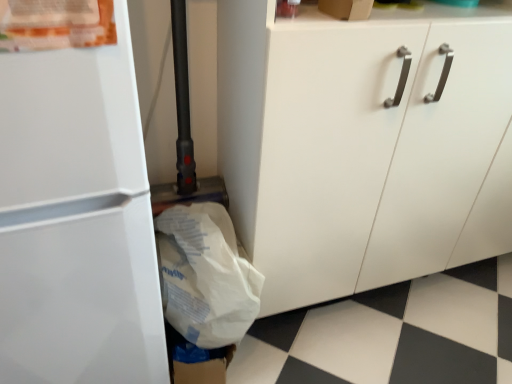
Question: Can you confirm if white glossy refrigerator at left is thinner than white matte cabinet at center?

Choices:
 (A) no
 (B) yes

Answer: (A)

Question: Could you tell me if white glossy refrigerator at left is turned towards white matte cabinet at center?

Choices:
 (A) no
 (B) yes

Answer: (A)

Question: Does white glossy refrigerator at left have a greater width compared to white matte cabinet at center?

Choices:
 (A) yes
 (B) no

Answer: (A)

Question: Is white glossy refrigerator at left positioned in front of white matte cabinet at center?

Choices:
 (A) yes
 (B) no

Answer: (A)

Question: Considering the relative positions of white glossy refrigerator at left and white matte cabinet at center in the image provided, is white glossy refrigerator at left behind white matte cabinet at center?

Choices:
 (A) yes
 (B) no

Answer: (B)

Question: Considering the positions of white paper grocery bag at lower left and white glossy refrigerator at left in the image, is white paper grocery bag at lower left taller or shorter than white glossy refrigerator at left?

Choices:
 (A) tall
 (B) short

Answer: (B)

Question: In the image, is white paper grocery bag at lower left positioned in front of or behind white glossy refrigerator at left?

Choices:
 (A) front
 (B) behind

Answer: (B)

Question: Is white paper grocery bag at lower left bigger or smaller than white glossy refrigerator at left?

Choices:
 (A) big
 (B) small

Answer: (B)

Question: Is point (183, 309) closer or farther from the camera than point (52, 69)?

Choices:
 (A) closer
 (B) farther

Answer: (B)

Question: Is white glossy refrigerator at left to the left or to the right of white paper grocery bag at lower left in the image?

Choices:
 (A) right
 (B) left

Answer: (B)

Question: Is point (x=55, y=99) positioned closer to the camera than point (x=224, y=276)?

Choices:
 (A) farther
 (B) closer

Answer: (B)

Question: In the image, is white glossy refrigerator at left positioned in front of or behind white paper grocery bag at lower left?

Choices:
 (A) front
 (B) behind

Answer: (A)

Question: In terms of height, does white glossy refrigerator at left look taller or shorter compared to white paper grocery bag at lower left?

Choices:
 (A) short
 (B) tall

Answer: (B)

Question: Based on their sizes in the image, would you say white matte cabinet at center is bigger or smaller than white paper grocery bag at lower left?

Choices:
 (A) small
 (B) big

Answer: (B)

Question: Considering the positions of point (352, 223) and point (253, 309), is point (352, 223) closer or farther from the camera than point (253, 309)?

Choices:
 (A) farther
 (B) closer

Answer: (A)